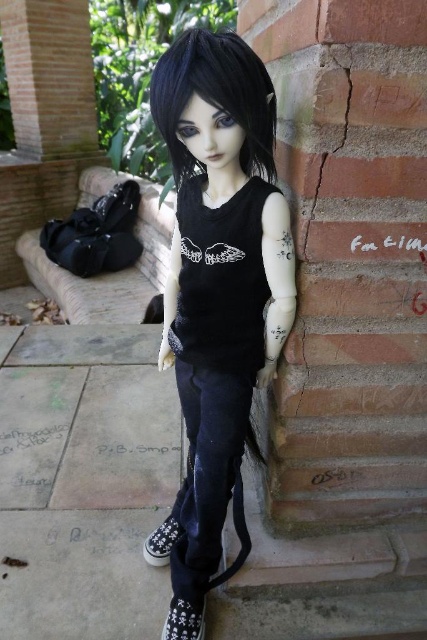
Question: Which of the following is the closest to the observer?

Choices:
 (A) (152, 564)
 (B) (177, 150)
 (C) (225, 106)
 (D) (175, 612)

Answer: (C)

Question: Can you confirm if white fabric shoe at lower center is thinner than black canvas shoe at lower left?

Choices:
 (A) no
 (B) yes

Answer: (B)

Question: Which point is farther to the camera?

Choices:
 (A) white fabric shoe at lower center
 (B) black matte hair at upper center

Answer: (A)

Question: Which is farther from the black canvas shoe at lower left?

Choices:
 (A) matte black doll at center
 (B) black matte hair at upper center
 (C) white fabric shoe at lower center

Answer: (B)

Question: Considering the relative positions of white fabric shoe at lower center and black canvas shoe at lower left in the image provided, where is white fabric shoe at lower center located with respect to black canvas shoe at lower left?

Choices:
 (A) above
 (B) below

Answer: (B)

Question: From the image, what is the correct spatial relationship of matte black doll at center in relation to black canvas shoe at lower left?

Choices:
 (A) left
 (B) right

Answer: (B)